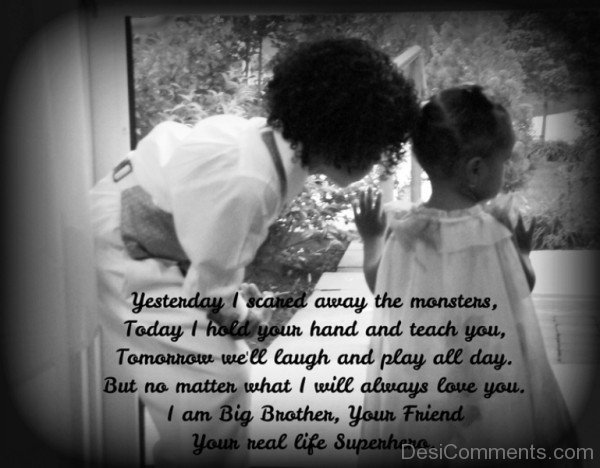
You are a GUI agent. You are given a task and a screenshot of the screen. Output one action in this format:
    pyautogui.click(x=<x>, y=<y>)
    Task: Click on the door
    
    Given the screenshot: What is the action you would take?
    pyautogui.click(x=54, y=295)